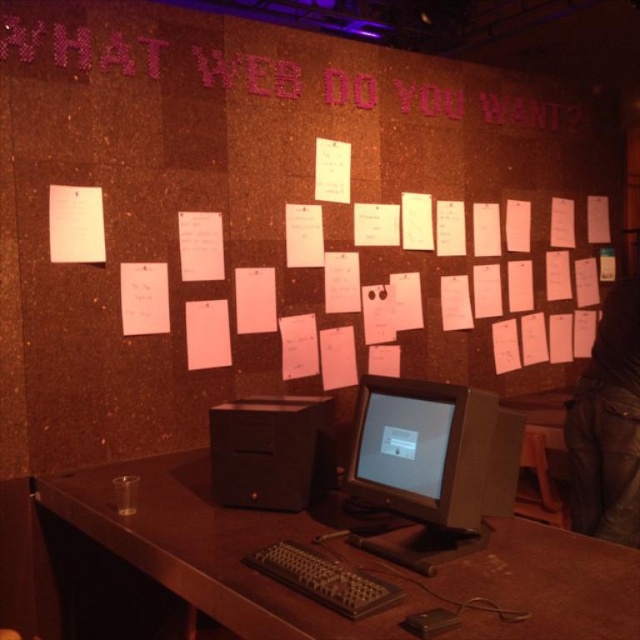
Question: Can you confirm if brown wooden table at center is positioned above matte black monitor at center?

Choices:
 (A) no
 (B) yes

Answer: (A)

Question: Estimate the real-world distances between objects in this image. Which object is farther from the corkboard at upper center?

Choices:
 (A) pink pixelated text at upper center
 (B) brown wooden table at center

Answer: (B)

Question: Does matte black monitor at center have a larger size compared to black plastic keyboard at lower center?

Choices:
 (A) yes
 (B) no

Answer: (A)

Question: Is black plastic computer at center thinner than black plastic keyboard at lower center?

Choices:
 (A) no
 (B) yes

Answer: (A)

Question: Among these objects, which one is nearest to the camera?

Choices:
 (A) black plastic keyboard at lower center
 (B) matte black monitor at center

Answer: (A)

Question: Estimate the real-world distances between objects in this image. Which object is closer to the black plastic computer at center?

Choices:
 (A) matte black monitor at center
 (B) black plastic keyboard at lower center

Answer: (A)